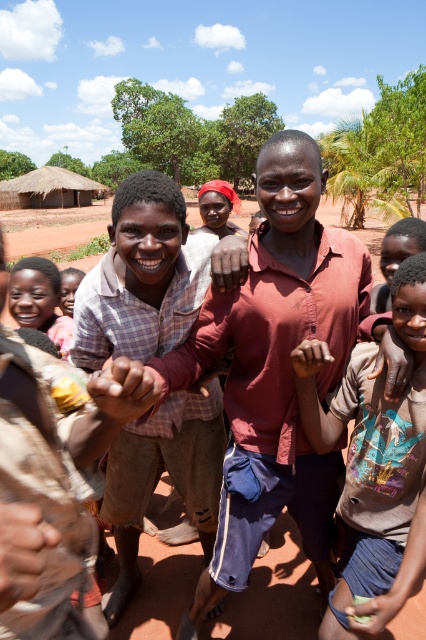
You are a photographer trying to capture a candid shot of the two boys in the scene. Your camera has a maximum focus range of 12 inches. Can you take a clear photo of both the matte red shirt at center and the light brown cotton shirt at center without moving your position?

The matte red shirt at center is 11.57 inches from the light brown cotton shirt at center, so yes, the camera can focus on both since the distance between them is within the 12 inches range.